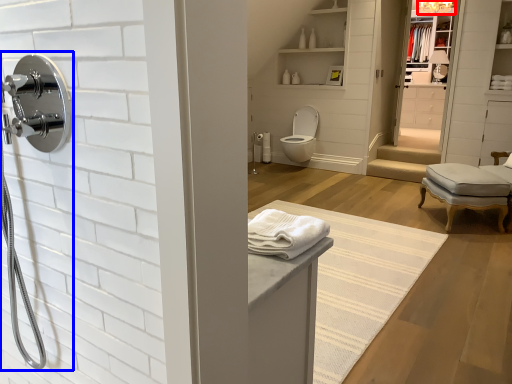
Question: Among these objects, which one is nearest to the camera, light fixture (highlighted by a red box) or shower (highlighted by a blue box)?

Choices:
 (A) light fixture
 (B) shower

Answer: (B)